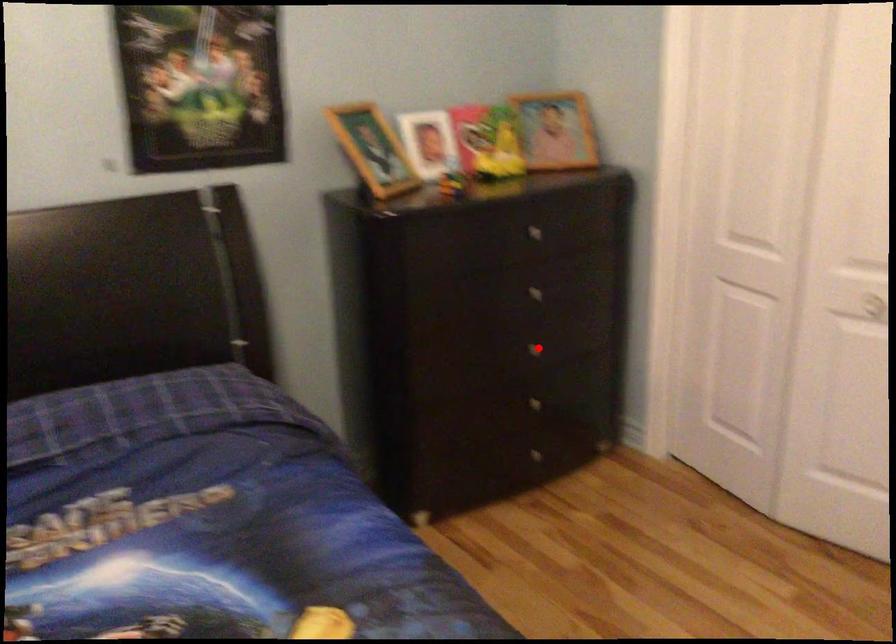
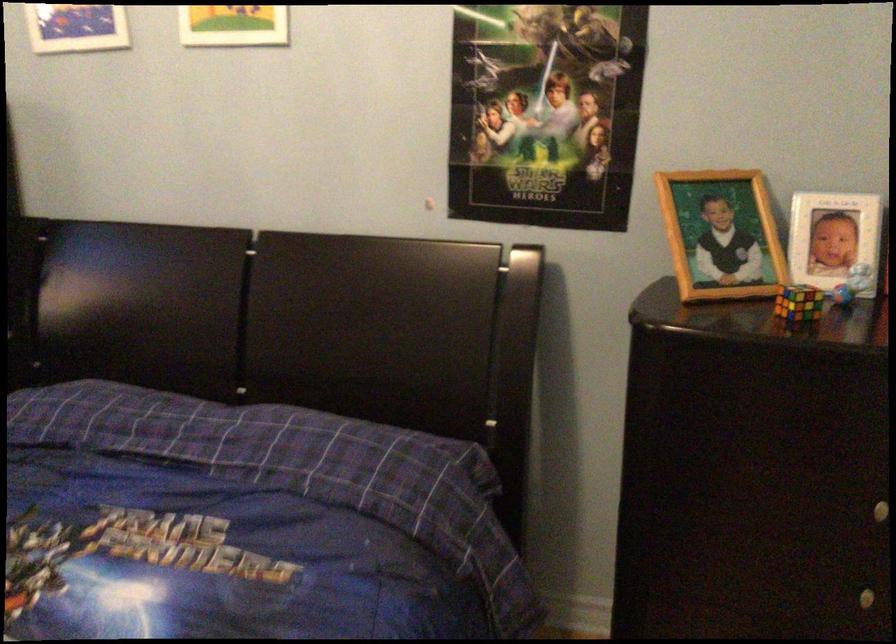
Where in the second image is the point corresponding to the highlighted location from the first image?

(868, 597)